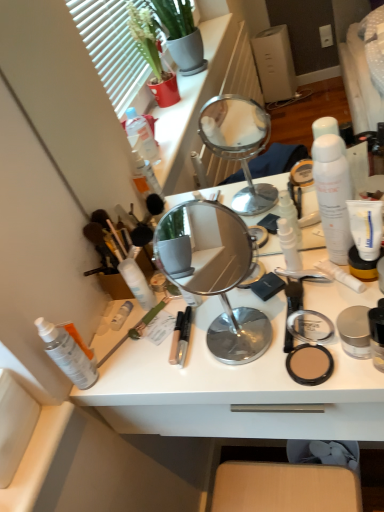
What are the coordinates of `empty space that is ontop of white plastic desk at center (from a real-world perspective)` in the screenshot? It's located at pos(232,321).